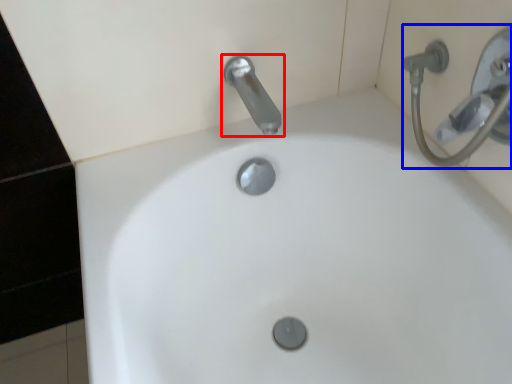
Question: Which object appears farthest to the camera in this image, tap (highlighted by a red box) or shower (highlighted by a blue box)?

Choices:
 (A) tap
 (B) shower

Answer: (A)